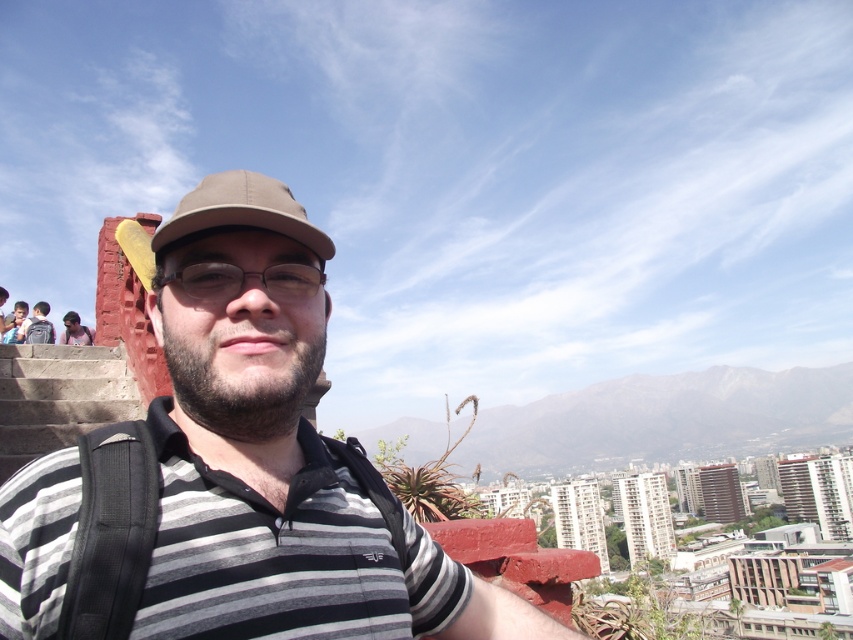
You are a photographer trying to capture the perfect selfie. You notice the clear plastic glasses at center and the striped cotton shirt at lower left in the frame. Which object appears smaller in the photo?

The clear plastic glasses at center appears smaller compared to the striped cotton shirt at lower left in the photo.

You are a photographer trying to capture the perfect shot of the two points in the image. The points are located at coordinates point (22, 323) and point (10, 332). Which point is positioned further away from the camera?

Point (22, 323) is behind point (10, 332), so it is further away from the camera.